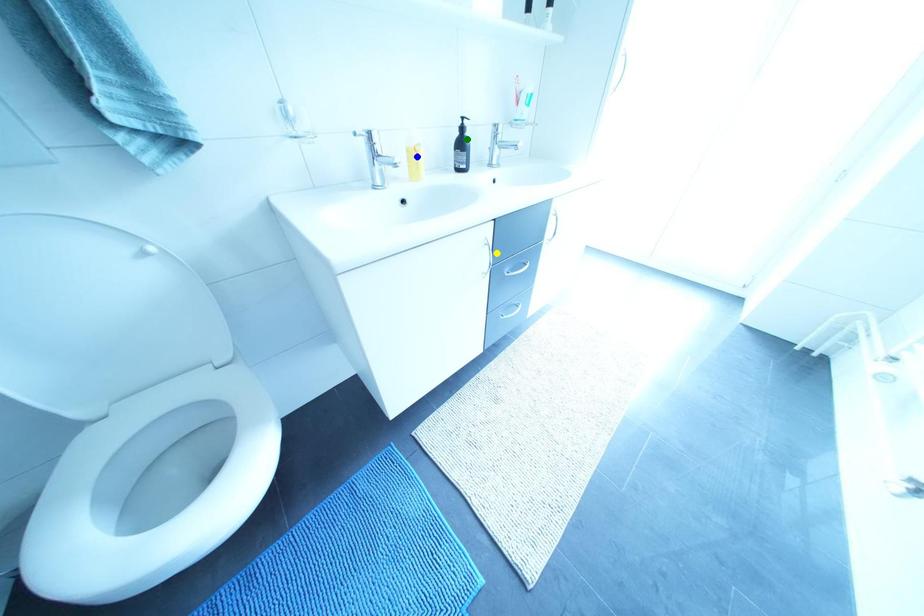
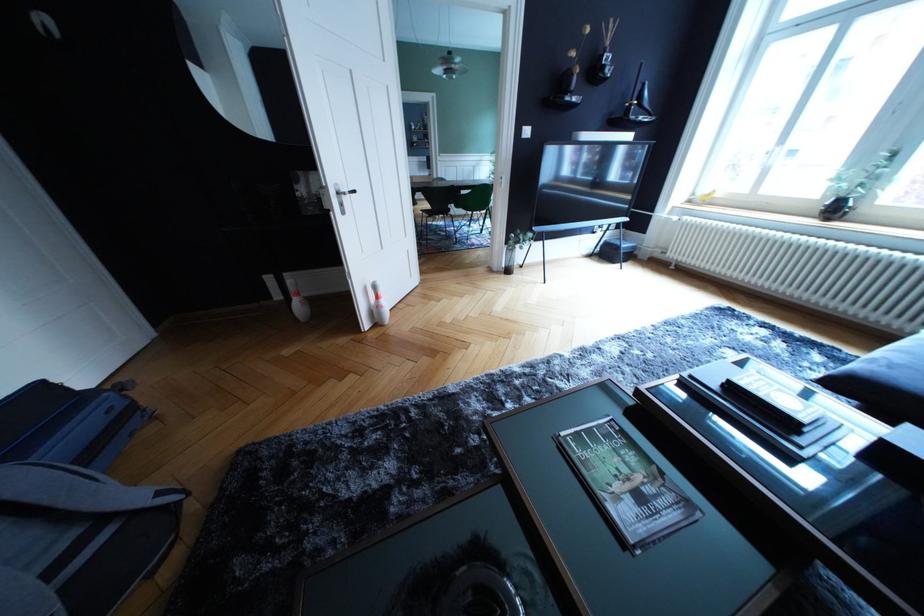
I am providing you with two images of the same scene from different viewpoints. Three points are marked in image1. Which point corresponds to a part or object that is occluded in image2?In image1, three points are marked. Which of them correspond to a part or object that is occluded in image2?Among the three points shown in image1, which one corresponds to a part or object that is no longer visible due to occlusion in image2?

Invisible in image2: green point, blue point, yellow point.